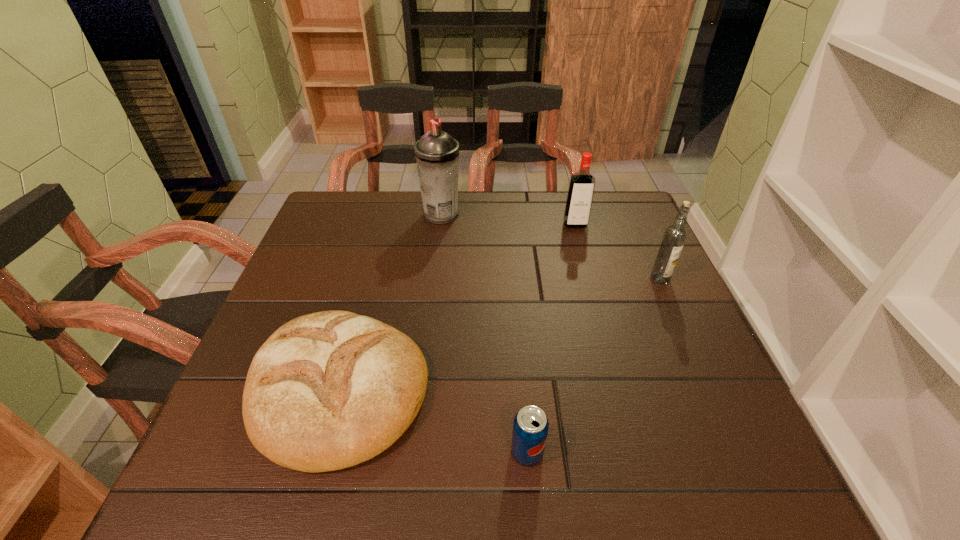
I want to click on aerosol can, so click(437, 153).

This screenshot has height=540, width=960. I want to click on the third farthest object, so click(674, 237).

At what (x,y) coordinates should I click in order to perform the action: click on the nearer vodka. Please return your answer as a coordinate pair (x, y). Looking at the image, I should click on (674, 237).

At what (x,y) coordinates should I click in order to perform the action: click on the left vodka. Please return your answer as a coordinate pair (x, y). This screenshot has width=960, height=540. Looking at the image, I should click on click(581, 188).

What are the coordinates of `the farther vodka` in the screenshot? It's located at (581, 188).

Where is `pop soda`? The height and width of the screenshot is (540, 960). pop soda is located at coordinates (530, 427).

I want to click on bread, so click(x=329, y=390).

Where is `vacant space located 0.350m on the right of the tallest object`? vacant space located 0.350m on the right of the tallest object is located at coordinates (580, 214).

Find the location of a particular element. The height and width of the screenshot is (540, 960). vacant region located 0.250m on the label of the right vodka is located at coordinates (701, 370).

Where is `vacant space located on the front and back of the fourth object from left to right`? vacant space located on the front and back of the fourth object from left to right is located at coordinates (582, 249).